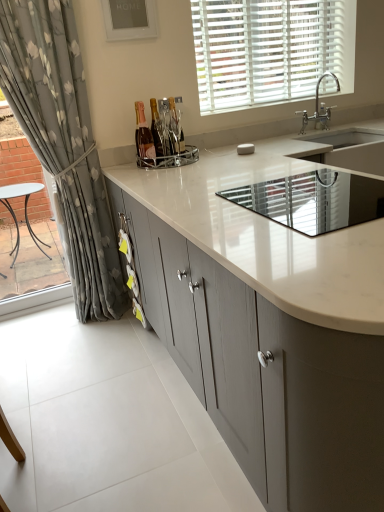
Question: Which direction should I rotate to face matte glass bottle at center, positioned as the first bottle in right-to-left order, — up or down?

Choices:
 (A) down
 (B) up

Answer: (B)

Question: Is matte glass bottle at center, positioned as the 2th bottle in right-to-left order, wider than white matte blinds at upper center?

Choices:
 (A) no
 (B) yes

Answer: (A)

Question: Is matte glass bottle at center, positioned as the 2th bottle in right-to-left order, with white matte blinds at upper center?

Choices:
 (A) yes
 (B) no

Answer: (B)

Question: From the image's perspective, is matte glass bottle at center, positioned as the 2th bottle in right-to-left order, located above white matte blinds at upper center?

Choices:
 (A) no
 (B) yes

Answer: (A)

Question: From a real-world perspective, is matte glass bottle at center, positioned as the 2th bottle in right-to-left order, located higher than white matte blinds at upper center?

Choices:
 (A) no
 (B) yes

Answer: (A)

Question: Is matte glass bottle at center, which appears as the 2th bottle when viewed from the left, to the left of white matte blinds at upper center from the viewer's perspective?

Choices:
 (A) no
 (B) yes

Answer: (B)

Question: Could you tell me if matte glass bottle at center, which appears as the 2th bottle when viewed from the left, is turned towards white matte blinds at upper center?

Choices:
 (A) yes
 (B) no

Answer: (B)

Question: Is chrome metallic wine rack at center, which ranks as the 1th appliance in left-to-right order, surrounding matte glass bottle at center, positioned as the first bottle in right-to-left order?

Choices:
 (A) yes
 (B) no

Answer: (B)

Question: Does chrome metallic wine rack at center, which is the second appliance from bottom to top, appear on the right side of matte glass bottle at center, positioned as the first bottle in right-to-left order?

Choices:
 (A) yes
 (B) no

Answer: (B)

Question: Is chrome metallic wine rack at center, positioned as the first appliance in back-to-front order, outside matte glass bottle at center, positioned as the first bottle in right-to-left order?

Choices:
 (A) yes
 (B) no

Answer: (A)

Question: From a real-world perspective, is chrome metallic wine rack at center, which ranks as the 1th appliance in left-to-right order, below matte glass bottle at center, positioned as the first bottle in right-to-left order?

Choices:
 (A) no
 (B) yes

Answer: (B)

Question: From the image's perspective, would you say chrome metallic wine rack at center, the second appliance viewed from the right, is positioned over matte glass bottle at center, the 3th bottle from the left?

Choices:
 (A) yes
 (B) no

Answer: (B)

Question: Is chrome metallic wine rack at center, which ranks as the 1th appliance in left-to-right order, smaller than matte glass bottle at center, the 3th bottle from the left?

Choices:
 (A) yes
 (B) no

Answer: (B)

Question: From a real-world perspective, is silver metallic faucet at upper right located beneath chrome metallic wine rack at center, the 1th appliance from the top?

Choices:
 (A) yes
 (B) no

Answer: (B)